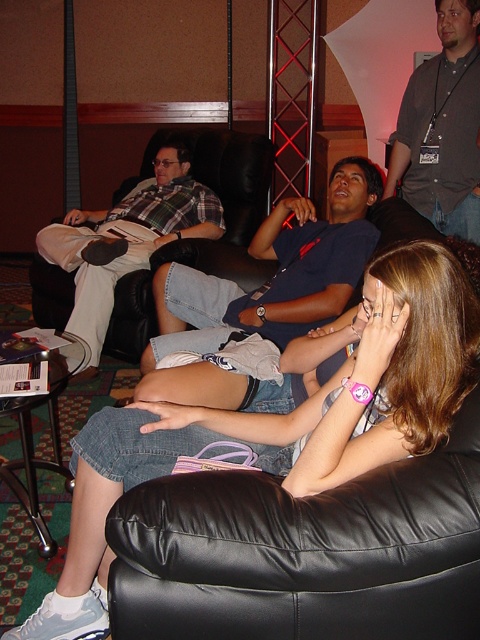
You are standing in the lounge area and want to determine which of the two points, point (296, 433) or point (180, 172), is nearer to you. Based on the coordinates provided, which point is closer?

Point (296, 433) is closer to the viewer than point (180, 172).

You are organizing a photo shoot and need to ensure that the denim skirt at lower left and the plaid fabric shirt at left are both visible in the frame. Given their sizes, which item requires more horizontal space to fully capture in the photo?

The denim skirt at lower left requires more horizontal space because its width surpasses that of the plaid fabric shirt at left.